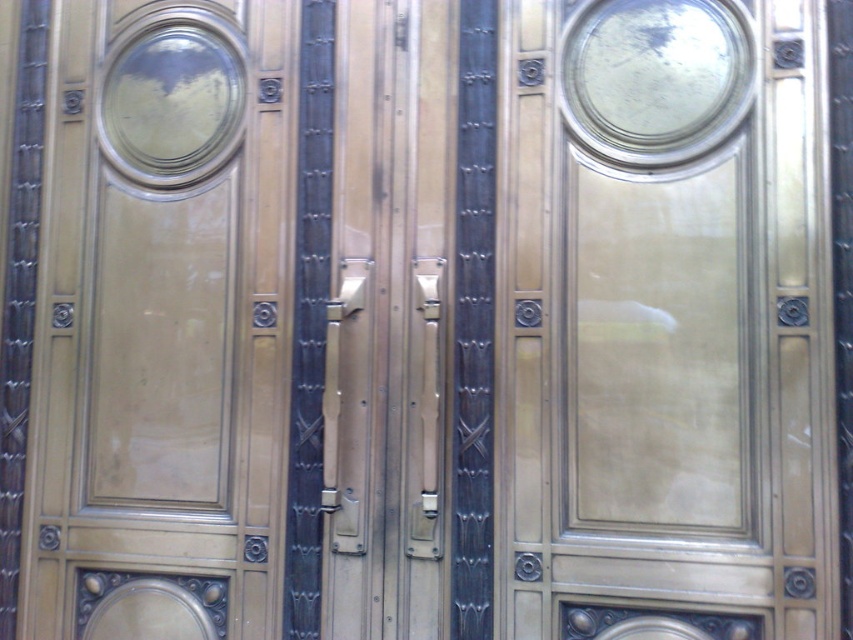
Question: Can you confirm if matte gold glass door at center is positioned to the right of metallic gold door at left?

Choices:
 (A) no
 (B) yes

Answer: (B)

Question: Can you confirm if matte gold glass door at center is positioned to the right of metallic gold door at left?

Choices:
 (A) no
 (B) yes

Answer: (B)

Question: Can you confirm if matte gold glass door at center is positioned to the left of metallic gold door at left?

Choices:
 (A) yes
 (B) no

Answer: (B)

Question: Which point is closer to the camera?

Choices:
 (A) matte gold glass door at center
 (B) metallic gold door at left

Answer: (A)